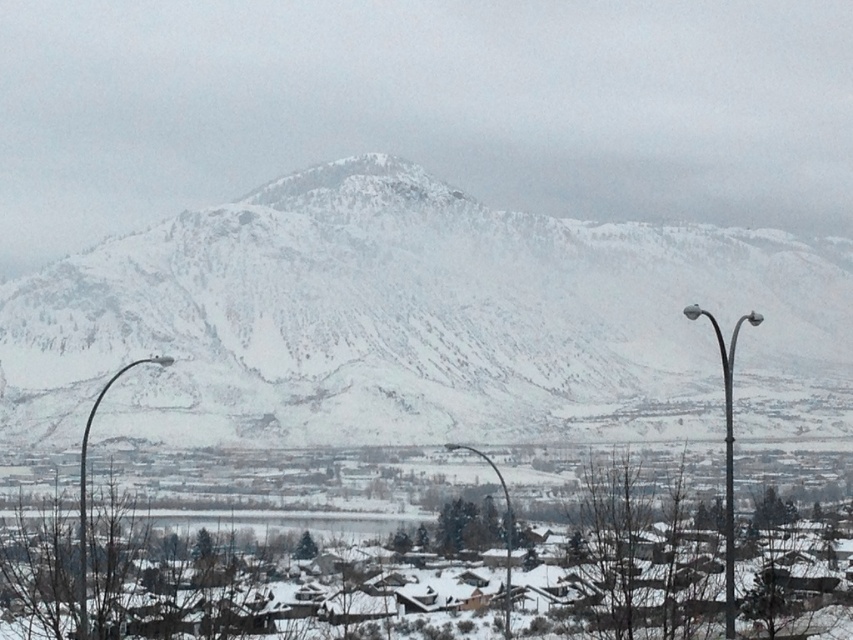
Does snowy rock formation at center have a lesser width compared to metallic gray streetlight at right?

No.

Where is `snowy rock formation at center`? The image size is (853, 640). snowy rock formation at center is located at coordinates (403, 316).

You are a GUI agent. You are given a task and a screenshot of the screen. Output one action in this format:
    pyautogui.click(x=<x>, y=<y>)
    Task: Click on the snowy rock formation at center
    Image resolution: width=853 pixels, height=640 pixels.
    Given the screenshot: What is the action you would take?
    pyautogui.click(x=403, y=316)

Identify the location of snowy rock formation at center. (403, 316).

Is metallic gray streetlight at right wider than glossy metal streetlight at lower center?

Yes, metallic gray streetlight at right is wider than glossy metal streetlight at lower center.

From the picture: Is metallic gray streetlight at right to the right of glossy metal streetlight at lower center from the viewer's perspective?

Correct, you'll find metallic gray streetlight at right to the right of glossy metal streetlight at lower center.

Which is in front, point (733, 596) or point (497, 474)?

Point (733, 596)

Where is `metallic gray streetlight at right`? This screenshot has width=853, height=640. metallic gray streetlight at right is located at coordinates (726, 451).

Between white snow-covered houses at lower center and metallic curved pole at left, which one has less height?

white snow-covered houses at lower center

Does white snow-covered houses at lower center appear on the left side of metallic curved pole at left?

In fact, white snow-covered houses at lower center is to the right of metallic curved pole at left.

Who is more forward, (32, 611) or (85, 618)?

Positioned in front is point (85, 618).

At what (x,y) coordinates should I click in order to perform the action: click on white snow-covered houses at lower center. Please return your answer as a coordinate pair (x, y). This screenshot has width=853, height=640. Looking at the image, I should click on (631, 563).